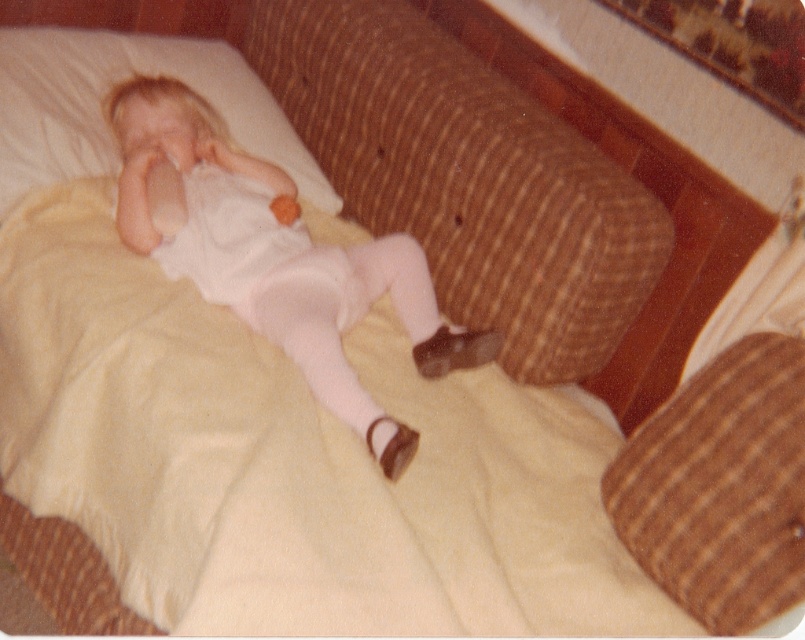
Does white matte onesie at center have a larger size compared to white soft pillow at upper left?

Yes.

Is white matte onesie at center closer to camera compared to white soft pillow at upper left?

That is True.

Locate an element on the screen. white matte onesie at center is located at coordinates click(x=275, y=257).

Who is higher up, white matte onesie at center or brown corduroy pillow at center?

white matte onesie at center

Is white matte onesie at center positioned in front of brown corduroy pillow at center?

No, white matte onesie at center is further to the viewer.

Identify the location of white matte onesie at center. This screenshot has width=805, height=640. (275, 257).

Who is positioned more to the left, brown corduroy pillow at center or white soft pillow at upper left?

white soft pillow at upper left is more to the left.

Does brown corduroy pillow at center lie in front of white soft pillow at upper left?

That is True.

Is point (766, 435) farther from viewer compared to point (14, 138)?

No, (766, 435) is closer to viewer.

The image size is (805, 640). Find the location of `brown corduroy pillow at center`. brown corduroy pillow at center is located at coordinates (720, 486).